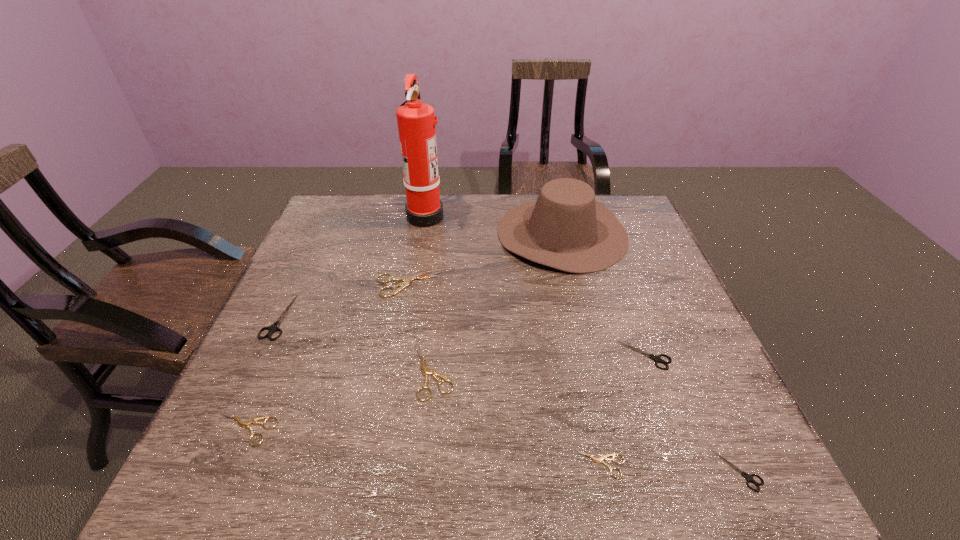
Where is `vacant region at the near edge of the desktop`? The height and width of the screenshot is (540, 960). vacant region at the near edge of the desktop is located at coordinates (540, 452).

Where is `free point at the left edge`? The image size is (960, 540). free point at the left edge is located at coordinates (268, 354).

The image size is (960, 540). I want to click on blank space at the right edge of the desktop, so click(x=634, y=278).

Find the location of `vacant space at the far left corner of the desktop`. vacant space at the far left corner of the desktop is located at coordinates (354, 211).

Locate an element on the screen. The height and width of the screenshot is (540, 960). free space at the near right corner of the desktop is located at coordinates (772, 483).

This screenshot has width=960, height=540. I want to click on blank region between the third nearest beige shears and the sixth shears from left to right, so click(x=539, y=363).

The width and height of the screenshot is (960, 540). I want to click on vacant area between the biggest black shears and the third nearest shears, so click(262, 373).

Where is `vacant point located between the red fire extinguisher and the rightmost shears`? Image resolution: width=960 pixels, height=540 pixels. vacant point located between the red fire extinguisher and the rightmost shears is located at coordinates (582, 343).

Where is `free spot between the second biggest beige shears and the second shears from right to left`? The height and width of the screenshot is (540, 960). free spot between the second biggest beige shears and the second shears from right to left is located at coordinates (539, 363).

You are a GUI agent. You are given a task and a screenshot of the screen. Output one action in this format:
    pyautogui.click(x=<x>, y=<y>)
    Task: Click on the free space between the biggest beige shears and the tallest object
    
    Given the screenshot: What is the action you would take?
    pyautogui.click(x=418, y=250)